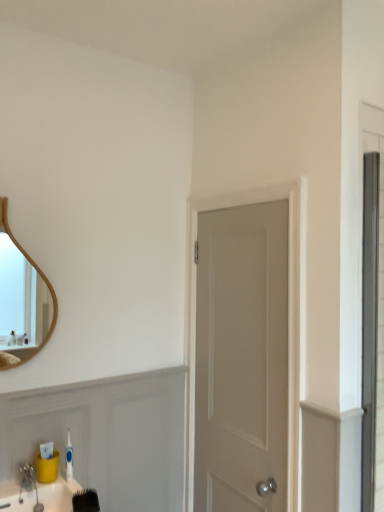
Question: Considering the positions of wooden mirror at upper left and brushed metal faucet at lower left in the image, is wooden mirror at upper left taller or shorter than brushed metal faucet at lower left?

Choices:
 (A) tall
 (B) short

Answer: (A)

Question: Relative to brushed metal faucet at lower left, is wooden mirror at upper left in front or behind?

Choices:
 (A) behind
 (B) front

Answer: (A)

Question: Which is nearer to the black bristle brush at lower left?

Choices:
 (A) wooden mirror at upper left
 (B) brushed metal faucet at lower left
 (C) white matte door at center

Answer: (B)

Question: Which object is the closest to the brushed metal faucet at lower left?

Choices:
 (A) wooden mirror at upper left
 (B) white matte door at center
 (C) black bristle brush at lower left

Answer: (C)